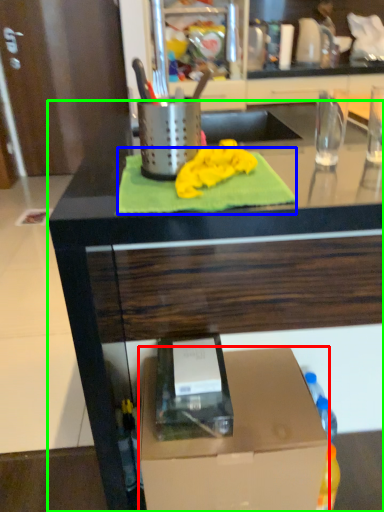
Question: Which object is positioned farthest from box (highlighted by a red box)? Select from bath towel (highlighted by a blue box) and countertop (highlighted by a green box).

Choices:
 (A) bath towel
 (B) countertop

Answer: (A)